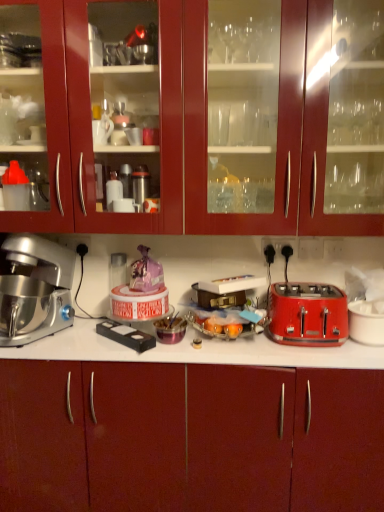
Question: From a real-world perspective, is black plastic electrical outlet at upper right over silver metallic stand mixer at left?

Choices:
 (A) yes
 (B) no

Answer: (A)

Question: Is there a large distance between black plastic electrical outlet at upper right and silver metallic stand mixer at left?

Choices:
 (A) yes
 (B) no

Answer: (B)

Question: Is black plastic electrical outlet at upper right to the left of silver metallic stand mixer at left from the viewer's perspective?

Choices:
 (A) yes
 (B) no

Answer: (B)

Question: From the image's perspective, is black plastic electrical outlet at upper right on top of silver metallic stand mixer at left?

Choices:
 (A) yes
 (B) no

Answer: (A)

Question: Is black plastic electrical outlet at upper right located outside silver metallic stand mixer at left?

Choices:
 (A) no
 (B) yes

Answer: (B)

Question: Considering the relative sizes of black plastic electrical outlet at upper right and silver metallic stand mixer at left in the image provided, is black plastic electrical outlet at upper right bigger than silver metallic stand mixer at left?

Choices:
 (A) no
 (B) yes

Answer: (A)

Question: From the image's perspective, would you say black plastic remote control at center is positioned over black plastic electrical outlet at upper right?

Choices:
 (A) no
 (B) yes

Answer: (A)

Question: Is black plastic remote control at center aimed at black plastic electrical outlet at upper right?

Choices:
 (A) yes
 (B) no

Answer: (B)

Question: Does black plastic remote control at center have a greater width compared to black plastic electrical outlet at upper right?

Choices:
 (A) no
 (B) yes

Answer: (B)

Question: Does black plastic remote control at center lie behind black plastic electrical outlet at upper right?

Choices:
 (A) yes
 (B) no

Answer: (B)

Question: Considering the relative sizes of black plastic remote control at center and black plastic electrical outlet at upper right in the image provided, is black plastic remote control at center smaller than black plastic electrical outlet at upper right?

Choices:
 (A) no
 (B) yes

Answer: (A)

Question: Can you confirm if black plastic remote control at center is thinner than black plastic electrical outlet at upper right?

Choices:
 (A) no
 (B) yes

Answer: (A)

Question: Is glossy wood cabinets at upper center, marked as the 1th cabinetry in a top-to-bottom arrangement, not within black plastic electrical outlet at upper right?

Choices:
 (A) no
 (B) yes

Answer: (B)